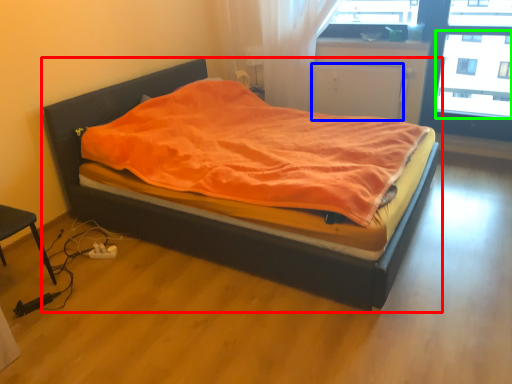
Question: Which object is positioned closest to bed (highlighted by a red box)? Select from screen door (highlighted by a blue box) and window screen (highlighted by a green box).

Choices:
 (A) screen door
 (B) window screen

Answer: (A)